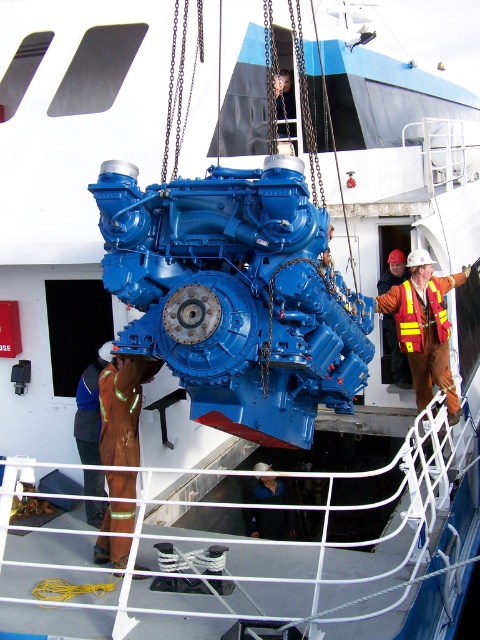
Who is positioned more to the right, reflective yellow safety vest at right or dark blue uniform at center?

From the viewer's perspective, reflective yellow safety vest at right appears more on the right side.

Between point (455, 410) and point (259, 513), which one is positioned in front?

Point (455, 410) is in front.

Who is more forward, (428, 337) or (263, 538)?

Point (428, 337) is more forward.

Find the location of a particular element. The image size is (480, 640). reflective yellow safety vest at right is located at coordinates (424, 326).

Is reflective yellow safety vest at right to the right of yellow reflective safety vest at right from the viewer's perspective?

Yes, reflective yellow safety vest at right is to the right of yellow reflective safety vest at right.

Is reflective yellow safety vest at right positioned behind yellow reflective safety vest at right?

No, it is not.

Where is `reflective yellow safety vest at right`? The height and width of the screenshot is (640, 480). reflective yellow safety vest at right is located at coordinates (424, 326).

Can you confirm if brown reflective safety vest at lower left is thinner than yellow reflective safety vest at right?

Indeed, brown reflective safety vest at lower left has a lesser width compared to yellow reflective safety vest at right.

Can you confirm if brown reflective safety vest at lower left is wider than yellow reflective safety vest at right?

In fact, brown reflective safety vest at lower left might be narrower than yellow reflective safety vest at right.

Locate an element on the screen. This screenshot has width=480, height=640. brown reflective safety vest at lower left is located at coordinates (90, 406).